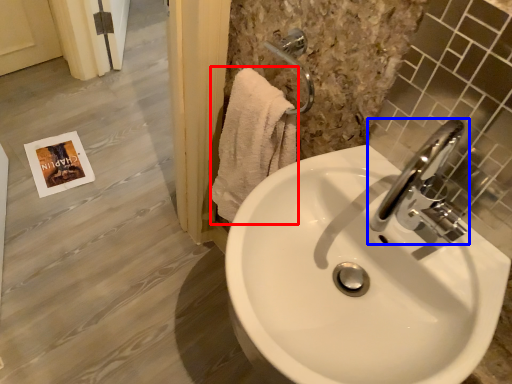
Question: Which point is further to the camera, bath towel (highlighted by a red box) or tap (highlighted by a blue box)?

Choices:
 (A) bath towel
 (B) tap

Answer: (A)